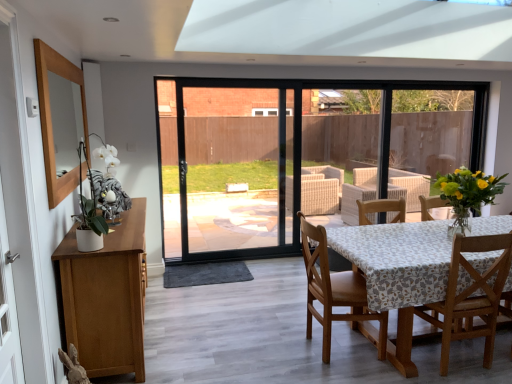
Question: Does white ceramic vase at left, arranged as the 1th floral arrangement when viewed from the front, lie behind wooden chair at lower right, arranged as the 1th chair when viewed from the right?

Choices:
 (A) yes
 (B) no

Answer: (B)

Question: Considering the relative sizes of white ceramic vase at left, placed as the second floral arrangement when sorted from right to left, and wooden chair at lower right, placed as the second chair when sorted from left to right, in the image provided, is white ceramic vase at left, placed as the second floral arrangement when sorted from right to left, bigger than wooden chair at lower right, placed as the second chair when sorted from left to right,?

Choices:
 (A) no
 (B) yes

Answer: (A)

Question: Is white ceramic vase at left, marked as the 2th floral arrangement in a back-to-front arrangement, to the left of wooden chair at lower right, placed as the second chair when sorted from left to right, from the viewer's perspective?

Choices:
 (A) no
 (B) yes

Answer: (B)

Question: Can you see white ceramic vase at left, which appears as the first floral arrangement when viewed from the left, touching wooden chair at lower right, placed as the second chair when sorted from left to right?

Choices:
 (A) no
 (B) yes

Answer: (A)

Question: Is white ceramic vase at left, which appears as the first floral arrangement when viewed from the left, to the right of wooden chair at lower right, arranged as the 1th chair when viewed from the right, from the viewer's perspective?

Choices:
 (A) no
 (B) yes

Answer: (A)

Question: Does point (x=322, y=249) appear closer or farther from the camera than point (x=458, y=241)?

Choices:
 (A) closer
 (B) farther

Answer: (B)

Question: Is wooden chair at center, the 2th chair from the right, taller or shorter than wooden chair at lower right, placed as the second chair when sorted from left to right?

Choices:
 (A) short
 (B) tall

Answer: (B)

Question: Considering their positions, is wooden chair at center, the 2th chair from the right, located in front of or behind wooden chair at lower right, placed as the second chair when sorted from left to right?

Choices:
 (A) front
 (B) behind

Answer: (B)

Question: From a real-world perspective, is wooden chair at center, the 2th chair from the right, above or below wooden chair at lower right, arranged as the 1th chair when viewed from the right?

Choices:
 (A) below
 (B) above

Answer: (A)

Question: Choose the correct answer: Is wooden chair at center, the 2th chair from the right, inside wooden mirror at left or outside it?

Choices:
 (A) outside
 (B) inside

Answer: (A)

Question: Is wooden chair at center, which is the 1th chair from left to right, in front of or behind wooden mirror at left in the image?

Choices:
 (A) front
 (B) behind

Answer: (B)

Question: In terms of size, does wooden chair at center, the 2th chair from the right, appear bigger or smaller than wooden mirror at left?

Choices:
 (A) big
 (B) small

Answer: (B)

Question: Is point [315, 271] closer or farther from the camera than point [32, 314]?

Choices:
 (A) closer
 (B) farther

Answer: (B)

Question: Looking at the image, does wooden mirror at left seem bigger or smaller compared to white ceramic vase at left, marked as the 2th floral arrangement in a back-to-front arrangement?

Choices:
 (A) small
 (B) big

Answer: (B)

Question: Is wooden mirror at left taller or shorter than white ceramic vase at left, placed as the second floral arrangement when sorted from right to left?

Choices:
 (A) short
 (B) tall

Answer: (B)